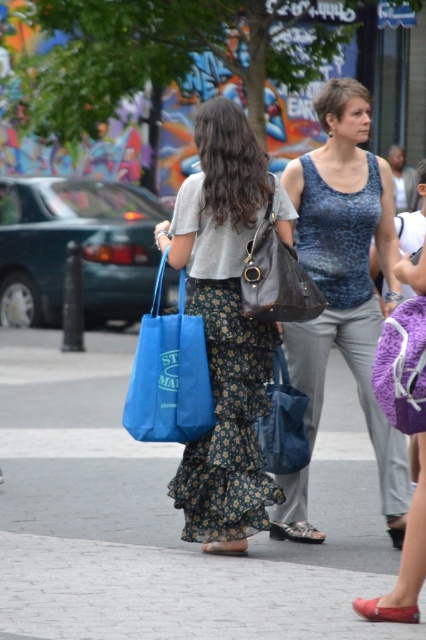
Question: Which object is the farthest from the leather textured sandal at lower center?

Choices:
 (A) blue fabric tote at center
 (B) leather textured handbag at center
 (C) floral skirt at center
 (D) denim blue bag at center

Answer: (B)

Question: Which of the following is the closest to the observer?

Choices:
 (A) floral skirt at center
 (B) purple fuzzy bag at center
 (C) denim blue bag at center
 (D) black leather sandal at lower center

Answer: (B)

Question: Which is farther from the denim blue bag at center?

Choices:
 (A) leather textured sandal at lower center
 (B) blue leopard print tank top at center
 (C) cobblestone pavement at center
 (D) leather flat sandal at lower center

Answer: (C)

Question: Can you confirm if matte red sandal at lower center is positioned to the left of black leather sandal at lower center?

Choices:
 (A) no
 (B) yes

Answer: (B)

Question: Does floral skirt at center appear on the left side of matte red sandal at lower center?

Choices:
 (A) no
 (B) yes

Answer: (B)

Question: Is blue fabric tote at center below matte red sandal at lower center?

Choices:
 (A) yes
 (B) no

Answer: (B)